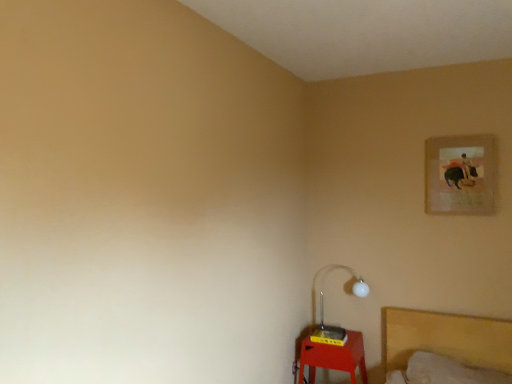
This screenshot has height=384, width=512. I want to click on matte paper picture frame at upper right, so click(460, 175).

The image size is (512, 384). In order to click on yellow plastic table at lower right in this screenshot , I will do `click(333, 357)`.

You are a GUI agent. You are given a task and a screenshot of the screen. Output one action in this format:
    pyautogui.click(x=<x>, y=<y>)
    Task: Click on the white glossy lamp at lower right
    
    Given the screenshot: What is the action you would take?
    pyautogui.click(x=323, y=309)

From the picture: Which object is thinner, yellow plastic table at lower right or white glossy lamp at lower right?

Thinner between the two is white glossy lamp at lower right.

Is yellow plastic table at lower right not inside white glossy lamp at lower right?

That's correct, yellow plastic table at lower right is outside of white glossy lamp at lower right.

Is yellow plastic table at lower right behind white glossy lamp at lower right?

No, it is not.

Between yellow plastic table at lower right and white glossy lamp at lower right, which one has larger size?

Bigger between the two is yellow plastic table at lower right.

From a real-world perspective, which object rests below the other?

yellow plastic table at lower right, from a real-world perspective.

Is matte paper picture frame at upper right next to yellow plastic table at lower right and touching it?

No, matte paper picture frame at upper right is not beside yellow plastic table at lower right.

Could you tell me if matte paper picture frame at upper right is facing yellow plastic table at lower right?

No.

Does matte paper picture frame at upper right have a smaller size compared to yellow plastic table at lower right?

Correct, matte paper picture frame at upper right occupies less space than yellow plastic table at lower right.

Considering the positions of objects yellow plastic table at lower right and matte paper picture frame at upper right in the image provided, who is more to the right, yellow plastic table at lower right or matte paper picture frame at upper right?

matte paper picture frame at upper right.

From the image's perspective, is yellow plastic table at lower right beneath matte paper picture frame at upper right?

Correct, yellow plastic table at lower right appears lower than matte paper picture frame at upper right in the image.

Considering the relative sizes of yellow plastic table at lower right and matte paper picture frame at upper right in the image provided, is yellow plastic table at lower right shorter than matte paper picture frame at upper right?

Indeed, yellow plastic table at lower right has a lesser height compared to matte paper picture frame at upper right.

Is yellow plastic table at lower right positioned with its back to matte paper picture frame at upper right?

That's not correct — yellow plastic table at lower right is not looking away from matte paper picture frame at upper right.

Considering the positions of objects white glossy lamp at lower right and matte paper picture frame at upper right in the image provided, who is in front, white glossy lamp at lower right or matte paper picture frame at upper right?

Positioned in front is matte paper picture frame at upper right.

From the image's perspective, which one is positioned lower, white glossy lamp at lower right or matte paper picture frame at upper right?

white glossy lamp at lower right, from the image's perspective.

Could matte paper picture frame at upper right be considered to be inside white glossy lamp at lower right?

No, white glossy lamp at lower right does not contain matte paper picture frame at upper right.

Does white glossy lamp at lower right turn towards matte paper picture frame at upper right?

No, white glossy lamp at lower right is not turned towards matte paper picture frame at upper right.

Can you confirm if matte paper picture frame at upper right is wider than white glossy lamp at lower right?

Incorrect, the width of matte paper picture frame at upper right does not surpass that of white glossy lamp at lower right.

From a real-world perspective, between matte paper picture frame at upper right and white glossy lamp at lower right, who is vertically lower?

white glossy lamp at lower right.

Who is more distant, matte paper picture frame at upper right or white glossy lamp at lower right?

white glossy lamp at lower right is further away from the camera.

From the image's perspective, which is below, matte paper picture frame at upper right or white glossy lamp at lower right?

white glossy lamp at lower right is shown below in the image.

Based on the photo, which object is closer to the camera taking this photo, white glossy lamp at lower right or yellow plastic table at lower right?

yellow plastic table at lower right is in front.

From a real-world perspective, which is physically below, white glossy lamp at lower right or yellow plastic table at lower right?

yellow plastic table at lower right is physically lower.

Can you confirm if white glossy lamp at lower right is positioned to the left of yellow plastic table at lower right?

No.

Where is `furniture lying in front of the white glossy lamp at lower right`? The height and width of the screenshot is (384, 512). furniture lying in front of the white glossy lamp at lower right is located at coordinates (333, 357).

The height and width of the screenshot is (384, 512). What are the coordinates of `furniture directly beneath the matte paper picture frame at upper right (from a real-world perspective)` in the screenshot? It's located at (333, 357).

Which object lies nearer to the anchor point white glossy lamp at lower right, yellow plastic table at lower right or matte paper picture frame at upper right?

Based on the image, yellow plastic table at lower right appears to be nearer to white glossy lamp at lower right.

Looking at the image, which one is located closer to matte paper picture frame at upper right, white glossy lamp at lower right or yellow plastic table at lower right?

Result: The object closer to matte paper picture frame at upper right is white glossy lamp at lower right.

Based on the photo, estimate the real-world distances between objects in this image. Which object is closer to matte paper picture frame at upper right, yellow plastic table at lower right or white glossy lamp at lower right?

white glossy lamp at lower right lies closer to matte paper picture frame at upper right than the other object.

When comparing their distances from yellow plastic table at lower right, does matte paper picture frame at upper right or white glossy lamp at lower right seem further?

matte paper picture frame at upper right lies further to yellow plastic table at lower right than the other object.

From the image, which object appears to be nearer to white glossy lamp at lower right, matte paper picture frame at upper right or yellow plastic table at lower right?

Among the two, yellow plastic table at lower right is located nearer to white glossy lamp at lower right.

When comparing their distances from yellow plastic table at lower right, does white glossy lamp at lower right or matte paper picture frame at upper right seem closer?

The object closer to yellow plastic table at lower right is white glossy lamp at lower right.

Find the location of a particular element. The image size is (512, 384). lamp between matte paper picture frame at upper right and yellow plastic table at lower right in the up-down direction is located at coordinates (323, 309).